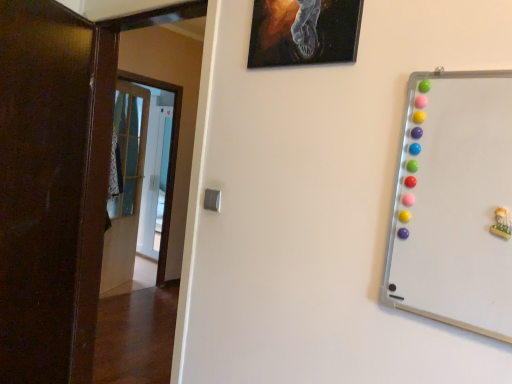
Question: Can you confirm if black canvas painting at upper center is thinner than dark wood door at left, which is counted as the first door, starting from the front?

Choices:
 (A) yes
 (B) no

Answer: (A)

Question: From a real-world perspective, is black canvas painting at upper center located beneath dark wood door at left, the third door positioned from the back?

Choices:
 (A) no
 (B) yes

Answer: (A)

Question: Is black canvas painting at upper center positioned before dark wood door at left, which is counted as the first door, starting from the front?

Choices:
 (A) no
 (B) yes

Answer: (B)

Question: From a real-world perspective, is black canvas painting at upper center located higher than dark wood door at left, which is counted as the first door, starting from the front?

Choices:
 (A) no
 (B) yes

Answer: (B)

Question: Can you confirm if black canvas painting at upper center is taller than dark wood door at left, the third door positioned from the back?

Choices:
 (A) yes
 (B) no

Answer: (B)

Question: Would you consider black canvas painting at upper center to be distant from dark wood door at left, the third door positioned from the back?

Choices:
 (A) no
 (B) yes

Answer: (B)

Question: Can you confirm if wooden door at left, the 1th door in the back-to-front sequence, is wider than whiteboard at right?

Choices:
 (A) yes
 (B) no

Answer: (A)

Question: Considering the relative sizes of wooden door at left, the 1th door in the back-to-front sequence, and whiteboard at right in the image provided, is wooden door at left, the 1th door in the back-to-front sequence, smaller than whiteboard at right?

Choices:
 (A) no
 (B) yes

Answer: (A)

Question: Considering the relative sizes of wooden door at left, which appears as the 3th door when viewed from the front, and whiteboard at right in the image provided, is wooden door at left, which appears as the 3th door when viewed from the front, taller than whiteboard at right?

Choices:
 (A) yes
 (B) no

Answer: (A)

Question: Can you confirm if wooden door at left, the 1th door in the back-to-front sequence, is bigger than whiteboard at right?

Choices:
 (A) no
 (B) yes

Answer: (B)

Question: Is wooden door at left, the 1th door in the back-to-front sequence, in front of whiteboard at right?

Choices:
 (A) yes
 (B) no

Answer: (B)

Question: Does wooden door at left, which appears as the 3th door when viewed from the front, appear on the left side of whiteboard at right?

Choices:
 (A) no
 (B) yes

Answer: (B)

Question: Is transparent glass door at center wider than dark wood door at left, the third door positioned from the back?

Choices:
 (A) no
 (B) yes

Answer: (B)